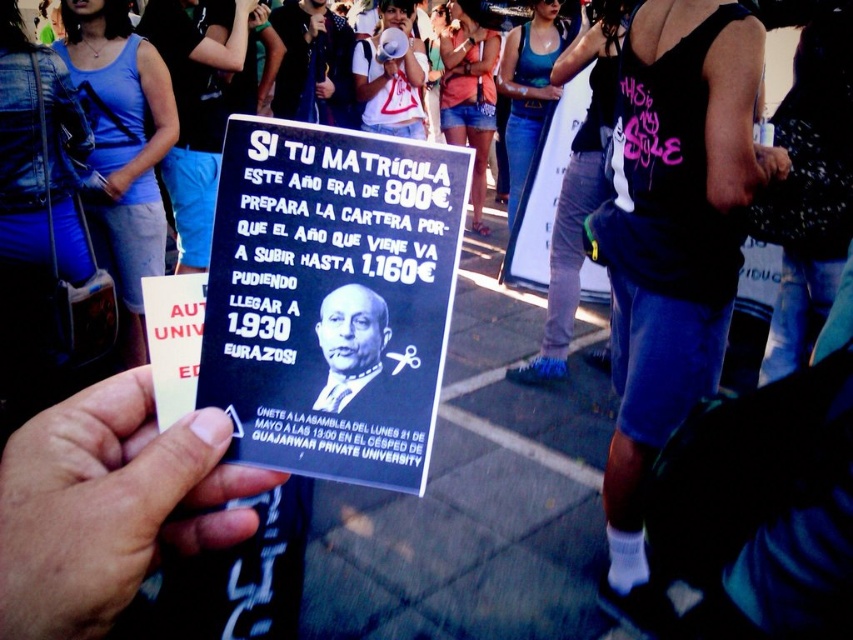
Does point (326, 160) come farther from viewer compared to point (668, 250)?

No, it is not.

How much distance is there between black paper poster at center and black matte tank top at center?

black paper poster at center is 1.43 meters from black matte tank top at center.

Between point (344, 440) and point (682, 276), which one is positioned behind?

The point (682, 276) is behind.

Find the location of `black paper poster at center`. black paper poster at center is located at coordinates tap(329, 298).

Is black matte tank top at center shorter than smooth black card at center?

In fact, black matte tank top at center may be taller than smooth black card at center.

Is black matte tank top at center smaller than smooth black card at center?

Incorrect, black matte tank top at center is not smaller in size than smooth black card at center.

Find the location of a particular element. Image resolution: width=853 pixels, height=640 pixels. black matte tank top at center is located at coordinates (672, 246).

You are a GUI agent. You are given a task and a screenshot of the screen. Output one action in this format:
    pyautogui.click(x=<x>, y=<y>)
    Task: Click on the black matte tank top at center
    The image size is (853, 640).
    Given the screenshot: What is the action you would take?
    pyautogui.click(x=672, y=246)

Which is more to the right, black matte tank top at center or smooth black suit at center?

black matte tank top at center

Consider the image. Which of these two, black matte tank top at center or smooth black suit at center, stands taller?

Standing taller between the two is black matte tank top at center.

Which is in front, point (614, 230) or point (335, 292)?

Point (335, 292)

At what (x,y) coordinates should I click in order to perform the action: click on black matte tank top at center. Please return your answer as a coordinate pair (x, y). Image resolution: width=853 pixels, height=640 pixels. Looking at the image, I should click on (672, 246).